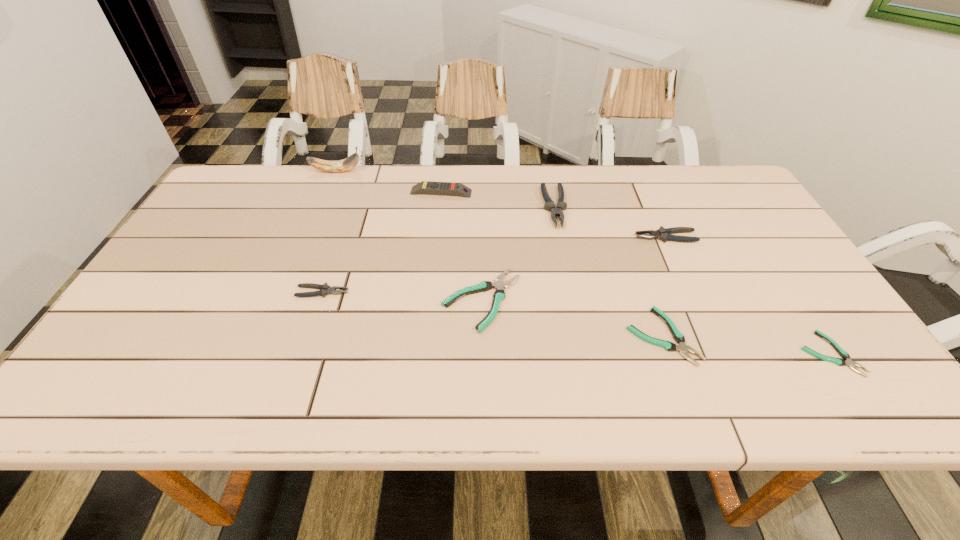
The height and width of the screenshot is (540, 960). In order to click on the farthest object in this screenshot , I will do `click(346, 164)`.

Identify the location of the tallest object. (346, 164).

This screenshot has width=960, height=540. Find the location of `the biggest gray pliers`. the biggest gray pliers is located at coordinates (549, 205).

Identify the location of the fourth pliers from right to left. (549, 205).

I want to click on yellow remote control, so click(x=449, y=188).

You are a GUI agent. You are given a task and a screenshot of the screen. Output one action in this format:
    pyautogui.click(x=<x>, y=<y>)
    Task: Click on the fourth farthest object
    The height and width of the screenshot is (540, 960).
    Given the screenshot: What is the action you would take?
    pyautogui.click(x=664, y=234)

At what (x,y) coordinates should I click in order to perform the action: click on the rightmost gray pliers. Please return your answer as a coordinate pair (x, y). This screenshot has height=540, width=960. Looking at the image, I should click on (664, 234).

Locate an element on the screen. Image resolution: width=960 pixels, height=540 pixels. the smallest gray pliers is located at coordinates (325, 289).

Identify the location of the leftmost pliers. The height and width of the screenshot is (540, 960). (325, 289).

Identify the location of the third shortest object. (499, 295).